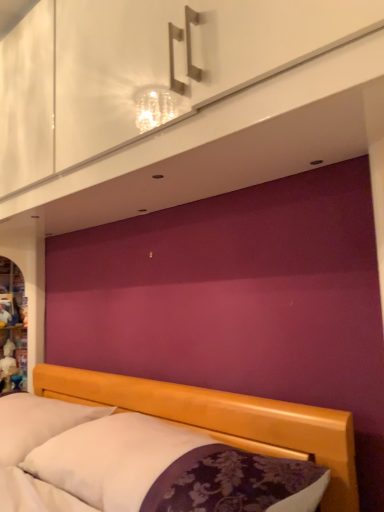
Question: From a real-world perspective, is white soft pillow at lower left over wooden bed at lower center?

Choices:
 (A) no
 (B) yes

Answer: (A)

Question: Is white soft pillow at lower left far from wooden bed at lower center?

Choices:
 (A) yes
 (B) no

Answer: (B)

Question: Can you confirm if white soft pillow at lower left is positioned to the right of wooden bed at lower center?

Choices:
 (A) no
 (B) yes

Answer: (A)

Question: Does white soft pillow at lower left have a lesser height compared to wooden bed at lower center?

Choices:
 (A) no
 (B) yes

Answer: (A)

Question: Does white soft pillow at lower left have a lesser width compared to wooden bed at lower center?

Choices:
 (A) no
 (B) yes

Answer: (A)

Question: Is white soft pillow at lower left wider or thinner than white glossy dresser at upper center?

Choices:
 (A) thin
 (B) wide

Answer: (B)

Question: Is white soft pillow at lower left inside or outside of white glossy dresser at upper center?

Choices:
 (A) outside
 (B) inside

Answer: (A)

Question: Is point (64, 428) closer or farther from the camera than point (216, 26)?

Choices:
 (A) farther
 (B) closer

Answer: (A)

Question: Visually, is white soft pillow at lower left positioned to the left or to the right of white glossy dresser at upper center?

Choices:
 (A) right
 (B) left

Answer: (B)

Question: From a real-world perspective, relative to matte white cabinet at left, is white soft pillow at lower left vertically above or below?

Choices:
 (A) above
 (B) below

Answer: (B)

Question: Is white soft pillow at lower left bigger or smaller than matte white cabinet at left?

Choices:
 (A) small
 (B) big

Answer: (B)

Question: Which is correct: white soft pillow at lower left is inside matte white cabinet at left, or outside of it?

Choices:
 (A) inside
 (B) outside

Answer: (B)

Question: Considering the positions of white soft pillow at lower left and matte white cabinet at left in the image, is white soft pillow at lower left wider or thinner than matte white cabinet at left?

Choices:
 (A) thin
 (B) wide

Answer: (B)

Question: Is wooden bed at lower center inside the boundaries of white soft pillow at lower left, or outside?

Choices:
 (A) outside
 (B) inside

Answer: (A)

Question: From the image's perspective, relative to white soft pillow at lower left, is wooden bed at lower center above or below?

Choices:
 (A) above
 (B) below

Answer: (A)